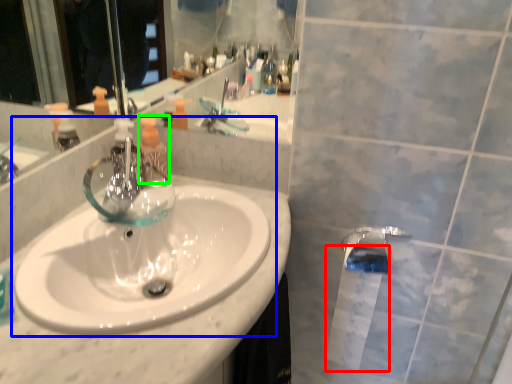
Question: Estimate the real-world distances between objects in this image. Which object is farther from toilet paper (highlighted by a red box), sink (highlighted by a blue box) or toiletry (highlighted by a green box)?

Choices:
 (A) sink
 (B) toiletry

Answer: (B)